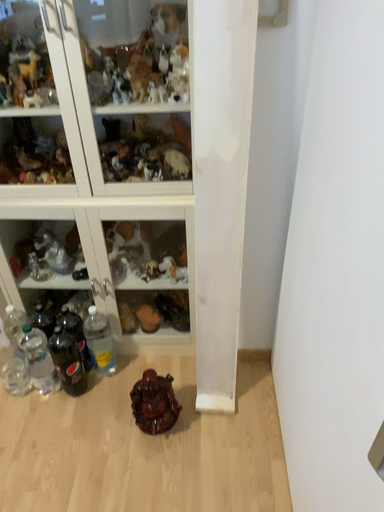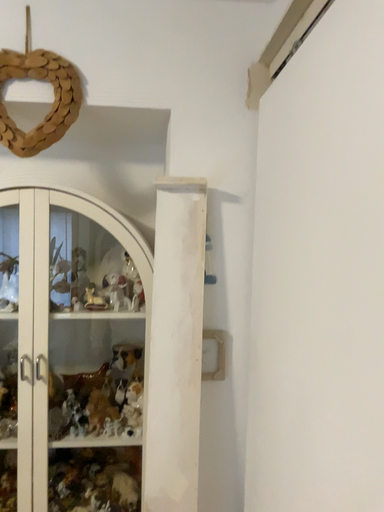
Question: Which way did the camera rotate in the video?

Choices:
 (A) rotated right
 (B) rotated left

Answer: (A)